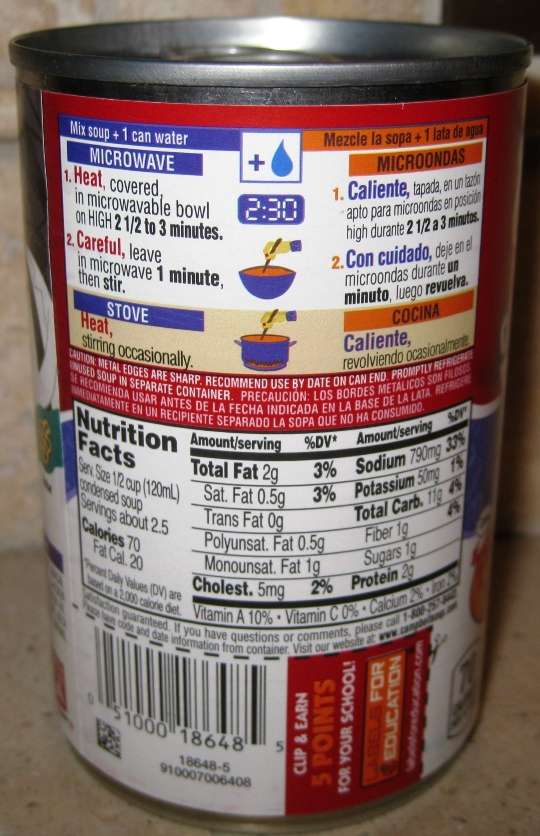
Locate an element on the screen. The width and height of the screenshot is (540, 836). bowl is located at coordinates (265, 287).